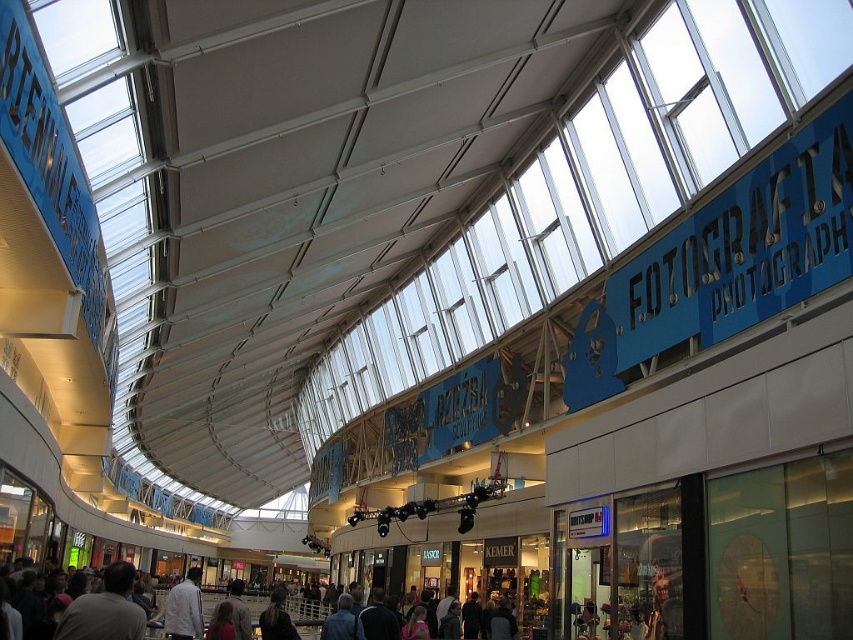
Looking at this image, you are a store manager organizing a display in the mall. You have a light brown leather jacket at center and a white shirt at center. Which item should you place in a smaller display area to ensure it fits properly?

The light brown leather jacket at center occupies less space than the white shirt at center, so it should be placed in the smaller display area to ensure it fits properly.

You are standing in the modern shopping mall and want to walk from point (200, 628) to point (263, 627). Which direction should you move to get closer to your destination?

You should move away from the viewer because point (200, 628) is closer to the viewer than point (263, 627).